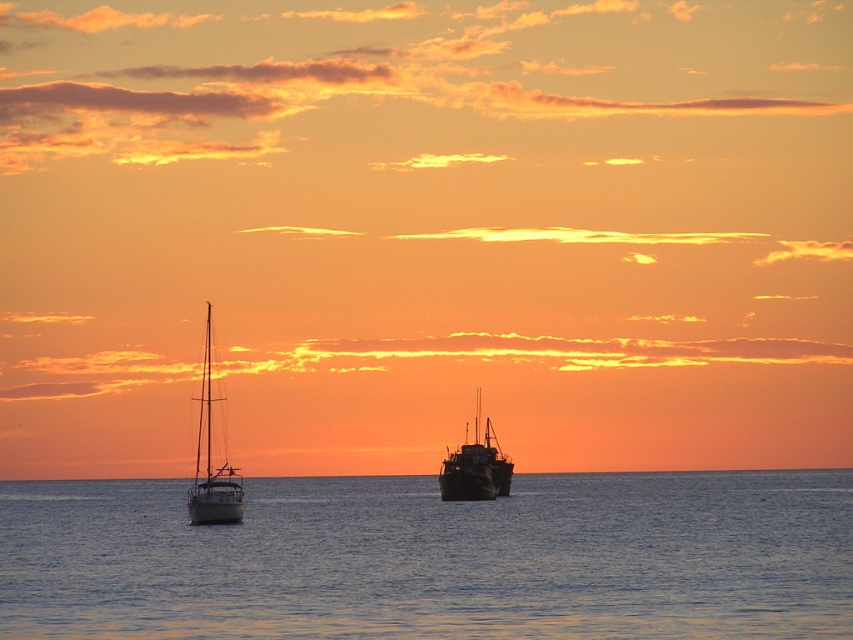
Question: Observing the image, what is the correct spatial positioning of clear blue water at center in reference to rusty metal boat at center?

Choices:
 (A) right
 (B) left

Answer: (B)

Question: Which object is farther from the camera taking this photo?

Choices:
 (A) shiny white sailboat at left
 (B) clear blue water at center
 (C) rusty metal boat at center

Answer: (C)

Question: Among these objects, which one is nearest to the camera?

Choices:
 (A) rusty metal boat at center
 (B) clear blue water at center
 (C) shiny white sailboat at left

Answer: (B)

Question: Does clear blue water at center appear under rusty metal boat at center?

Choices:
 (A) no
 (B) yes

Answer: (B)

Question: Which of the following is the closest to the observer?

Choices:
 (A) (241, 502)
 (B) (477, 413)

Answer: (A)

Question: Can you confirm if clear blue water at center is positioned to the left of shiny white sailboat at left?

Choices:
 (A) yes
 (B) no

Answer: (B)